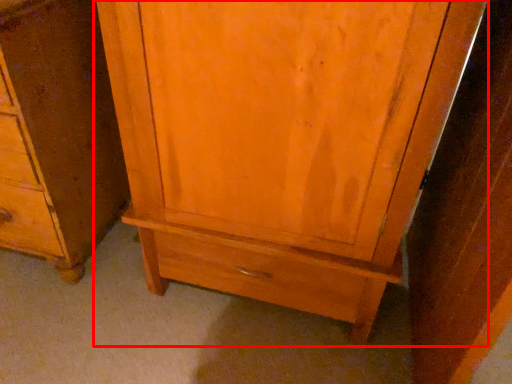
Question: From the image's perspective, where is cupboard (annotated by the red box) located in relation to chest of drawers in the image?

Choices:
 (A) above
 (B) below

Answer: (B)